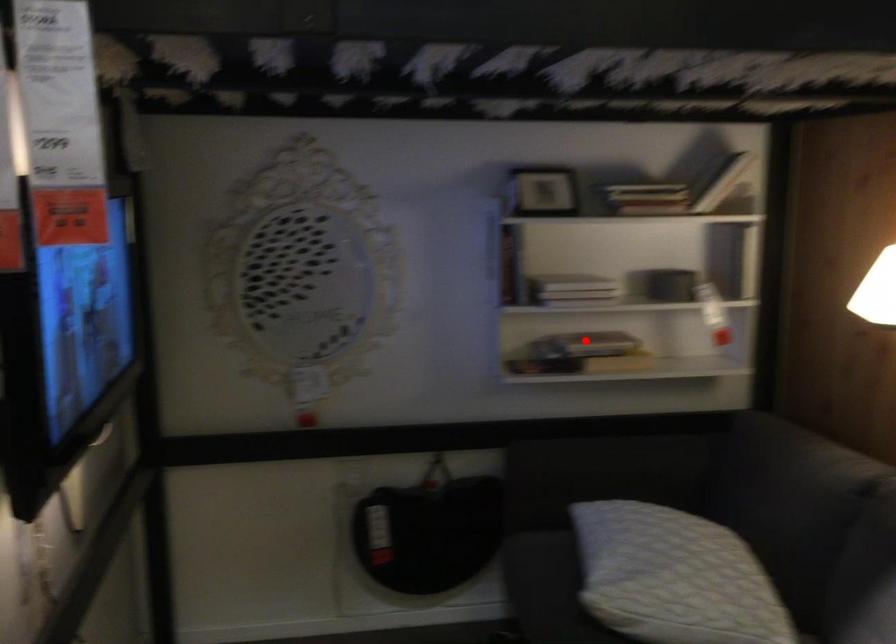
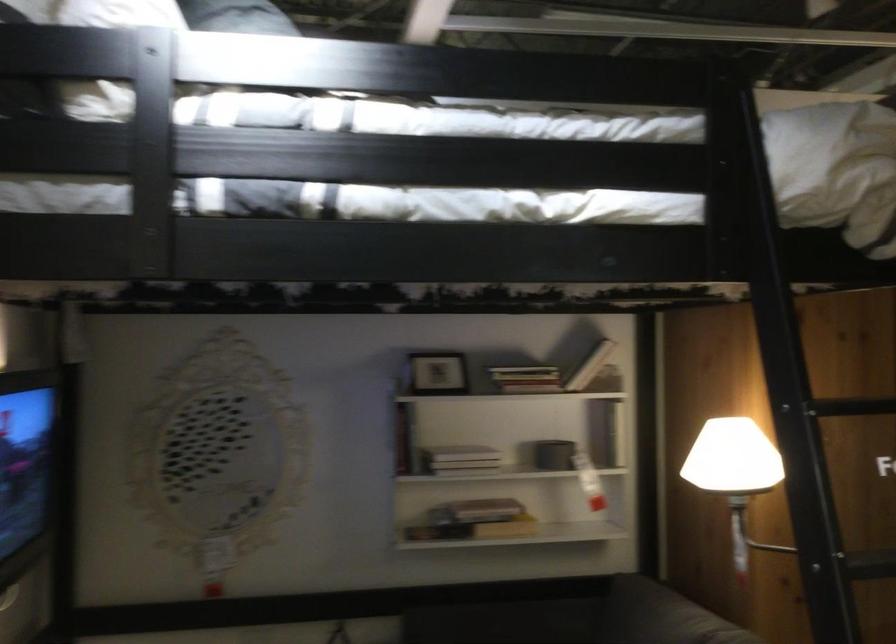
Where in the second image is the point corresponding to the highlighted location from the first image?

(476, 511)